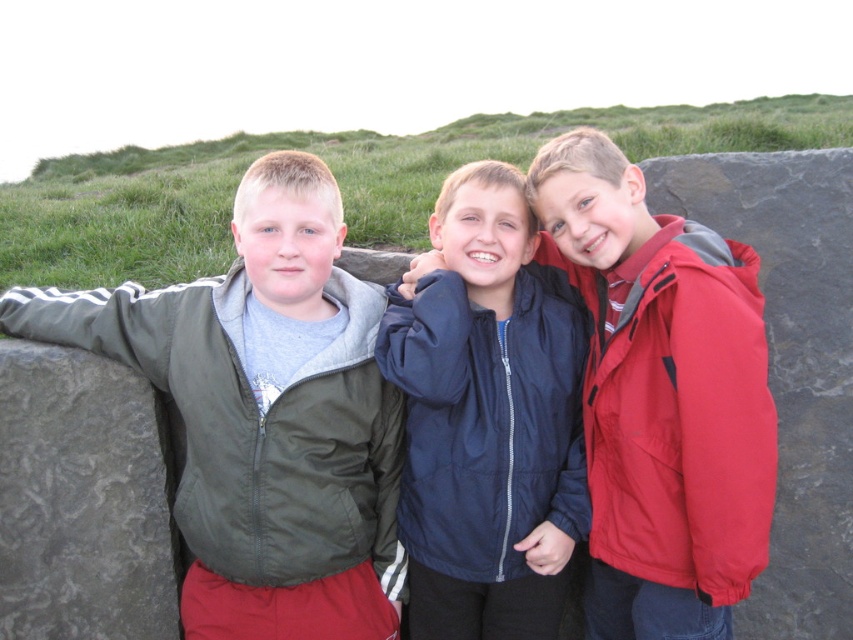
Question: Which of the following is the closest to the observer?

Choices:
 (A) matte red jacket at right
 (B) gray textured stone at left

Answer: (A)

Question: Is matte green jacket at left closer to the viewer compared to matte red jacket at right?

Choices:
 (A) no
 (B) yes

Answer: (A)

Question: Can you confirm if matte green jacket at left is positioned to the right of red matte jacket at right?

Choices:
 (A) yes
 (B) no

Answer: (B)

Question: From the image, what is the correct spatial relationship of navy blue jacket at center in relation to gray textured stone at left?

Choices:
 (A) left
 (B) right

Answer: (B)

Question: Which of these objects is positioned farthest from the matte blue jacket at center?

Choices:
 (A) green grass at upper center
 (B) matte green jacket at left
 (C) gray textured stone at left

Answer: (A)

Question: Which object appears farthest from the camera in this image?

Choices:
 (A) green grass at upper center
 (B) navy blue jacket at center

Answer: (A)